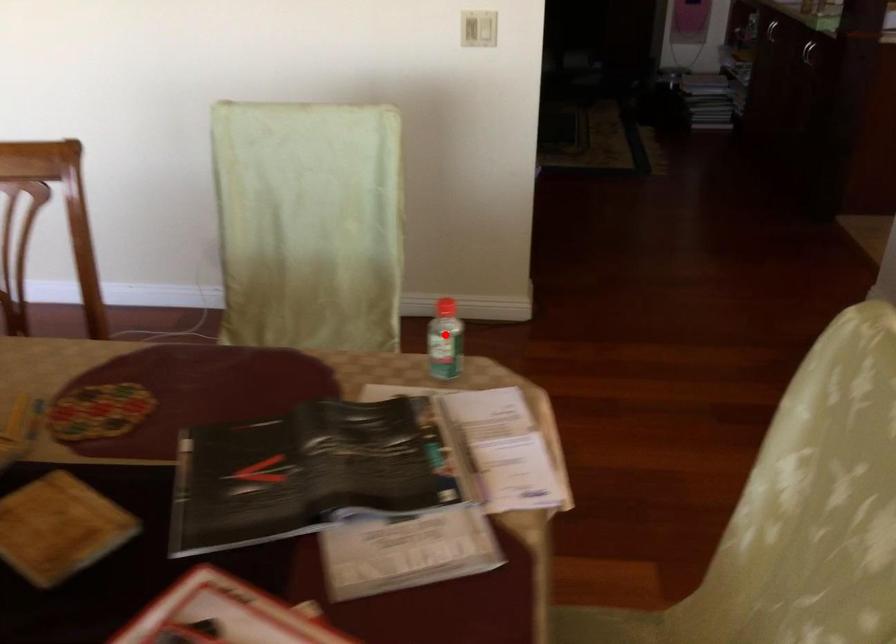
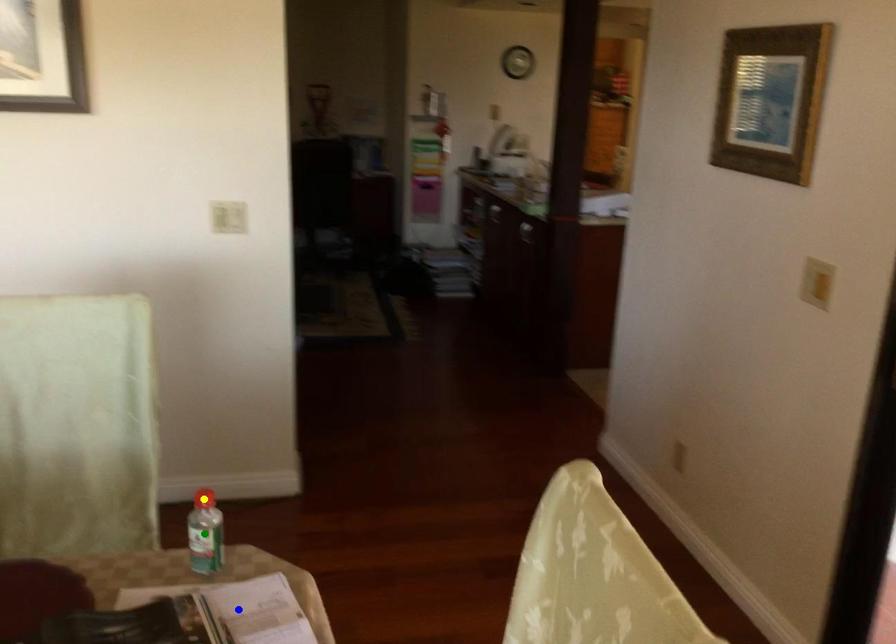
Question: I am providing you with two images of the same scene from different viewpoints. A red point is marked on the first image. You are given multiple points on the second image. In image 2, which mark is for the same physical point as the one in image 1?

Choices:
 (A) blue point
 (B) yellow point
 (C) green point

Answer: (C)